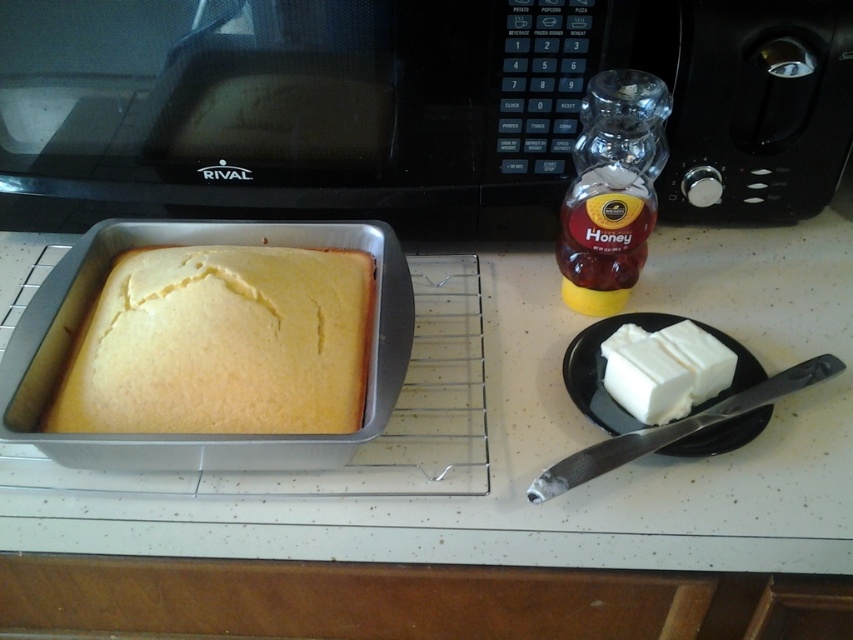
Question: Does translucent glass honey jar at right appear under white creamy butter at right?

Choices:
 (A) no
 (B) yes

Answer: (A)

Question: Among these objects, which one is farthest from the camera?

Choices:
 (A) black plastic microwave at upper center
 (B) translucent glass honey jar at right
 (C) yellow matte cake at center

Answer: (A)

Question: Among these points, which one is farthest from the camera?

Choices:
 (A) (654, 132)
 (B) (625, 380)
 (C) (195, 384)

Answer: (A)

Question: Among these points, which one is nearest to the camera?

Choices:
 (A) pos(695,388)
 (B) pos(254,216)
 (C) pos(637,88)

Answer: (A)

Question: Is yellow matte cake at center smaller than translucent glass honey jar at right?

Choices:
 (A) yes
 (B) no

Answer: (B)

Question: Does black plastic microwave at upper center have a larger size compared to white creamy butter at right?

Choices:
 (A) yes
 (B) no

Answer: (A)